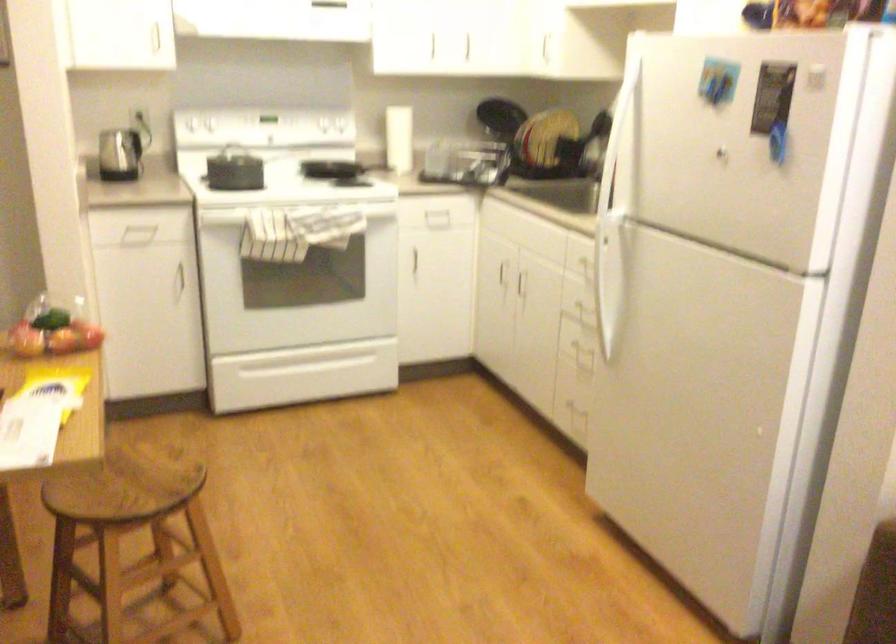
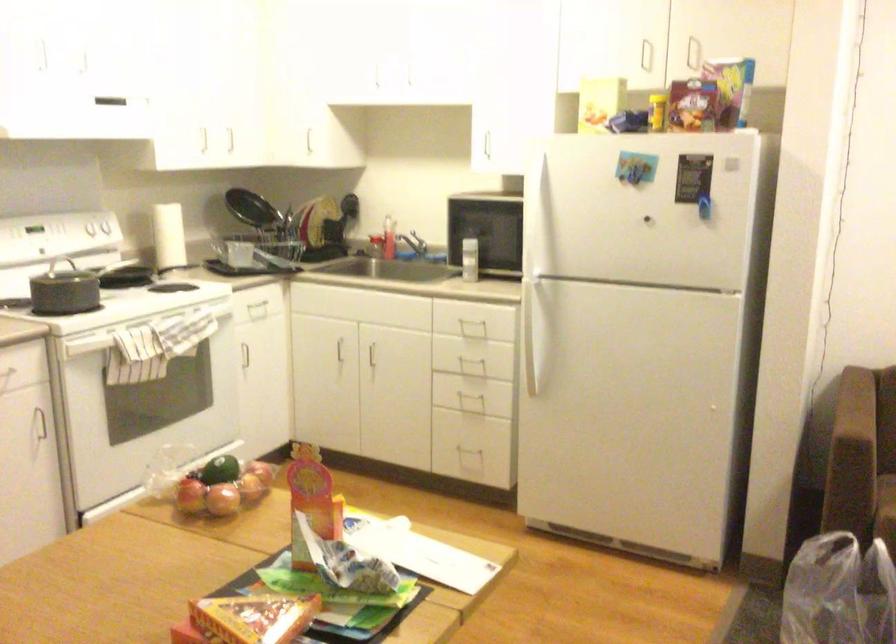
In the second image, find the point that corresponds to (309,115) in the first image.

(98, 232)